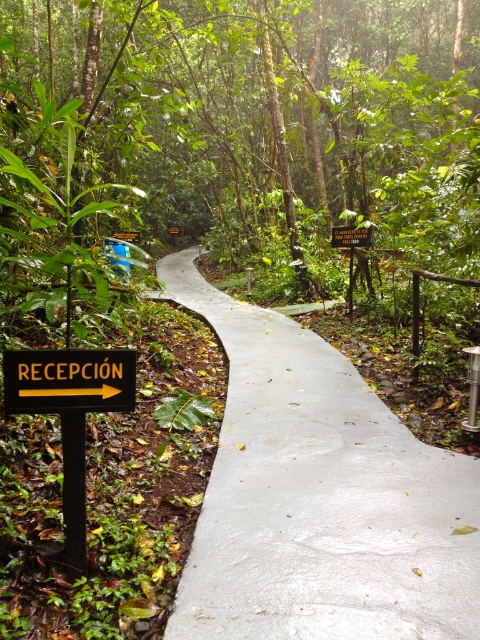
Question: Which of the following is the farthest from the observer?

Choices:
 (A) (112, 381)
 (B) (360, 241)

Answer: (B)

Question: Which is nearer to the white concrete path at center?

Choices:
 (A) wooden sign at center
 (B) yellowmaterial/texturesign at left

Answer: (B)

Question: Which object is farther from the camera taking this photo?

Choices:
 (A) white concrete path at center
 (B) wooden sign at center

Answer: (B)

Question: Where is white concrete path at center located in relation to yellowmaterial/texturesign at left in the image?

Choices:
 (A) below
 (B) above

Answer: (A)

Question: Is white concrete path at center smaller than wooden sign at center?

Choices:
 (A) no
 (B) yes

Answer: (A)

Question: Where is white concrete path at center located in relation to wooden sign at center in the image?

Choices:
 (A) below
 (B) above

Answer: (A)